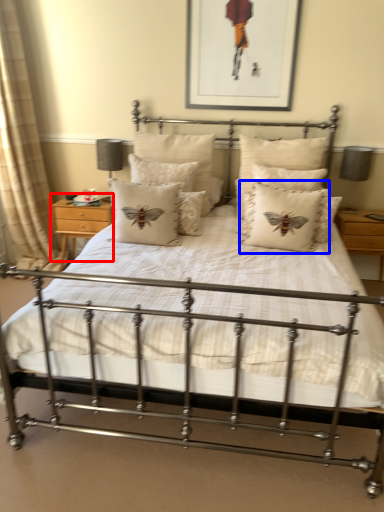
Question: Which object appears closest to the camera in this image, nightstand (highlighted by a red box) or pillow (highlighted by a blue box)?

Choices:
 (A) nightstand
 (B) pillow

Answer: (B)